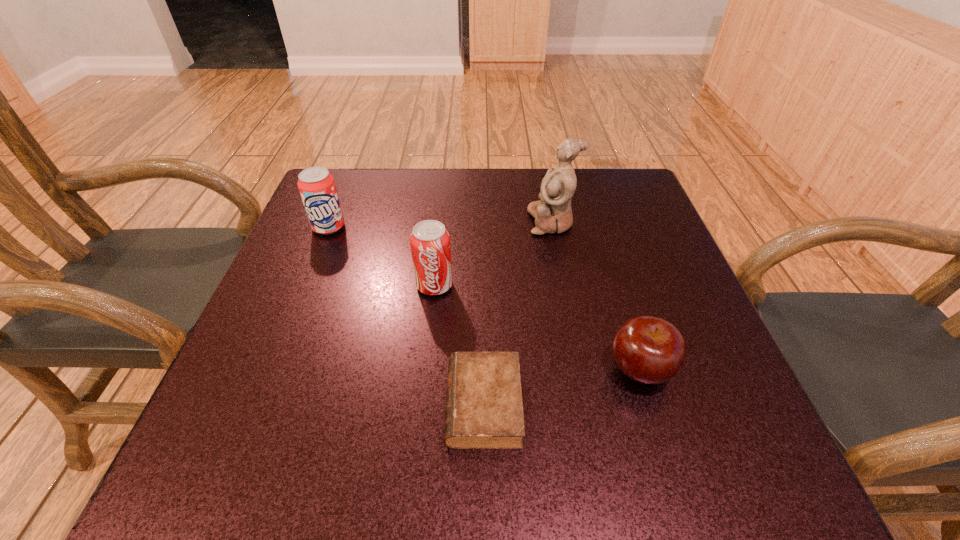
Identify the location of vacant area that lies between the left soda can and the third object from left to right. (406, 316).

You are a GUI agent. You are given a task and a screenshot of the screen. Output one action in this format:
    pyautogui.click(x=<x>, y=<y>)
    Task: Click on the free spot between the figurine and the third object from right to left
    
    Given the screenshot: What is the action you would take?
    pyautogui.click(x=517, y=313)

Image resolution: width=960 pixels, height=540 pixels. I want to click on vacant area that lies between the diary and the left soda can, so click(406, 316).

This screenshot has width=960, height=540. I want to click on free space that is in between the right soda can and the fourth tallest object, so click(x=538, y=327).

Locate an element on the screen. free space between the third nearest object and the diary is located at coordinates (459, 345).

I want to click on free spot between the third farthest object and the left soda can, so click(382, 256).

This screenshot has width=960, height=540. Identify the location of free point between the apple and the shortest object. [562, 387].

What are the coordinates of `vacant area between the nearer soda can and the left soda can` in the screenshot? It's located at (382, 256).

The height and width of the screenshot is (540, 960). What are the coordinates of `the third closest object to the second shortest object` in the screenshot? It's located at (552, 213).

Identify which object is the second closest to the second shortest object. Please provide its 2D coordinates. Your answer should be formatted as a tuple, i.e. [(x, y)], where the tuple contains the x and y coordinates of a point satisfying the conditions above.

[(430, 242)]